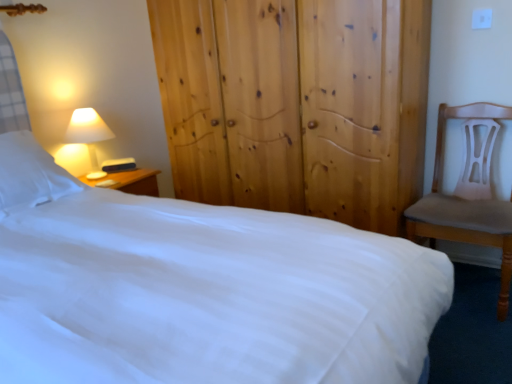
What do you see at coordinates (465, 205) in the screenshot? I see `light brown wooden chair at right` at bounding box center [465, 205].

At what (x,y) coordinates should I click in order to perform the action: click on white soft pillow at left. Please return your answer as a coordinate pair (x, y). This screenshot has width=512, height=384. Looking at the image, I should click on (30, 174).

Identify the location of matte white lampshade at left. point(88,135).

Measure the distance between white smooth bed at center and camera.

The distance of white smooth bed at center from camera is 28.74 inches.

The height and width of the screenshot is (384, 512). In order to click on light brown wooden chair at right in this screenshot , I will do `click(465, 205)`.

Is white soft pillow at left facing towards white smooth bed at center?

Yes, white soft pillow at left is facing white smooth bed at center.

Is white soft pillow at left at the right side of white smooth bed at center?

Incorrect, white soft pillow at left is not on the right side of white smooth bed at center.

Can you tell me how much white soft pillow at left and white smooth bed at center differ in facing direction?

The facing directions of white soft pillow at left and white smooth bed at center are 0.834 degrees apart.

Considering their positions, is white soft pillow at left located in front of or behind white smooth bed at center?

Visually, white soft pillow at left is located behind white smooth bed at center.

Could white smooth bed at center be considered to be inside matte white lampshade at left?

No, white smooth bed at center is not surrounded by matte white lampshade at left.

Is matte white lampshade at left wider or thinner than white smooth bed at center?

Considering their sizes, matte white lampshade at left looks slimmer than white smooth bed at center.

Where is `lamp above the white smooth bed at center (from the image's perspective)`? lamp above the white smooth bed at center (from the image's perspective) is located at coordinates [88, 135].

Who is bigger, white soft pillow at left or natural wood wardrobe at center?

natural wood wardrobe at center is bigger.

Which object is thinner, white soft pillow at left or natural wood wardrobe at center?

Thinner between the two is white soft pillow at left.

Considering the sizes of objects white soft pillow at left and natural wood wardrobe at center in the image provided, who is taller, white soft pillow at left or natural wood wardrobe at center?

natural wood wardrobe at center is taller.

Is natural wood wardrobe at center at the back of white soft pillow at left?

white soft pillow at left is not turned away from natural wood wardrobe at center.

Considering the sizes of objects white soft pillow at left and matte white lampshade at left in the image provided, who is smaller, white soft pillow at left or matte white lampshade at left?

matte white lampshade at left.

Consider the image. Is white soft pillow at left oriented towards matte white lampshade at left?

No, white soft pillow at left does not turn towards matte white lampshade at left.

Which object is closer to the camera, white soft pillow at left or matte white lampshade at left?

white soft pillow at left is in front.

Is white soft pillow at left shorter than matte white lampshade at left?

Yes, white soft pillow at left is shorter than matte white lampshade at left.

Is the position of light brown wooden chair at right more distant than that of white soft pillow at left?

No, it is in front of white soft pillow at left.

Based on their sizes in the image, would you say light brown wooden chair at right is bigger or smaller than white soft pillow at left?

Clearly, light brown wooden chair at right is larger in size than white soft pillow at left.

Is light brown wooden chair at right not inside white soft pillow at left?

Yes, light brown wooden chair at right is not within white soft pillow at left.

Would you consider light brown wooden chair at right to be distant from white soft pillow at left?

Yes, light brown wooden chair at right and white soft pillow at left are quite far apart.

Is matte white lampshade at left smaller than natural wood wardrobe at center?

Correct, matte white lampshade at left occupies less space than natural wood wardrobe at center.

From the image's perspective, who appears lower, matte white lampshade at left or natural wood wardrobe at center?

matte white lampshade at left.

Locate an element on the screen. This screenshot has width=512, height=384. lamp below the natural wood wardrobe at center (from the image's perspective) is located at coordinates (88, 135).

Is matte white lampshade at left inside the boundaries of natural wood wardrobe at center, or outside?

matte white lampshade at left is spatially situated outside natural wood wardrobe at center.

Looking at their sizes, would you say matte white lampshade at left is wider or thinner than light brown wooden chair at right?

matte white lampshade at left is thinner than light brown wooden chair at right.

Which point is more distant from viewer, (103, 132) or (447, 208)?

The point (103, 132) is farther from the camera.

Could you tell me if matte white lampshade at left is turned towards light brown wooden chair at right?

Yes.

Which of these two, matte white lampshade at left or light brown wooden chair at right, stands taller?

With more height is light brown wooden chair at right.

Find the location of `bed located underneath the white soft pillow at left (from a real-world perspective)`. bed located underneath the white soft pillow at left (from a real-world perspective) is located at coordinates (199, 289).

Find the location of a particular element. The width and height of the screenshot is (512, 384). bed below the matte white lampshade at left (from the image's perspective) is located at coordinates (199, 289).

Considering their positions, is white smooth bed at center positioned further to matte white lampshade at left than light brown wooden chair at right?

light brown wooden chair at right.

Looking at the image, which one is located further to matte white lampshade at left, natural wood wardrobe at center or white smooth bed at center?

The object further to matte white lampshade at left is white smooth bed at center.

Looking at the image, which one is located further to natural wood wardrobe at center, light brown wooden chair at right or matte white lampshade at left?

matte white lampshade at left is positioned further to the anchor natural wood wardrobe at center.

Which object lies further to the anchor point white soft pillow at left, matte white lampshade at left or natural wood wardrobe at center?

The object further to white soft pillow at left is natural wood wardrobe at center.

Looking at the image, which one is located further to white smooth bed at center, matte white lampshade at left or light brown wooden chair at right?

matte white lampshade at left is positioned further to the anchor white smooth bed at center.

Looking at the image, which one is located further to light brown wooden chair at right, white smooth bed at center or natural wood wardrobe at center?

The object further to light brown wooden chair at right is white smooth bed at center.

In the scene shown: From the image, which object appears to be nearer to light brown wooden chair at right, white smooth bed at center or matte white lampshade at left?

Among the two, white smooth bed at center is located nearer to light brown wooden chair at right.

Which object lies nearer to the anchor point white soft pillow at left, white smooth bed at center or matte white lampshade at left?

white smooth bed at center lies closer to white soft pillow at left than the other object.

Find the location of a particular element. This screenshot has height=384, width=512. lamp between white soft pillow at left and light brown wooden chair at right is located at coordinates (88, 135).

At what (x,y) coordinates should I click in order to perform the action: click on dresser between white smooth bed at center and matte white lampshade at left from front to back. Please return your answer as a coordinate pair (x, y). The height and width of the screenshot is (384, 512). Looking at the image, I should click on (296, 104).

At what (x,y) coordinates should I click in order to perform the action: click on lamp between white soft pillow at left and natural wood wardrobe at center from left to right. Please return your answer as a coordinate pair (x, y). Looking at the image, I should click on (88, 135).

At what (x,y) coordinates should I click in order to perform the action: click on bed between white soft pillow at left and light brown wooden chair at right. Please return your answer as a coordinate pair (x, y). Image resolution: width=512 pixels, height=384 pixels. Looking at the image, I should click on (199, 289).